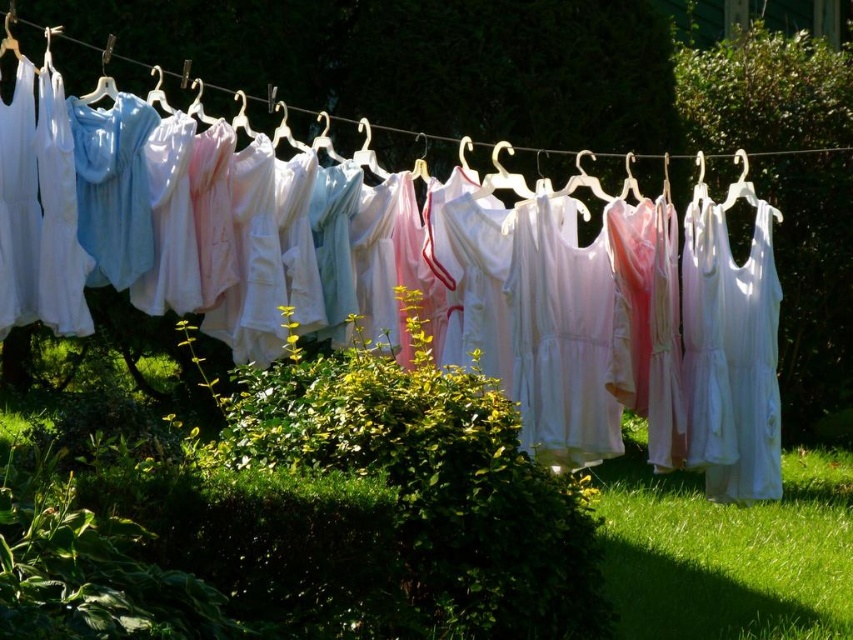
Question: Is white cotton dresses at center bigger than green grass at center?

Choices:
 (A) yes
 (B) no

Answer: (A)

Question: Which object is farther from the camera taking this photo?

Choices:
 (A) green grass at center
 (B) green grass at lower right

Answer: (A)

Question: Which point is closer to the camera?

Choices:
 (A) green grass at center
 (B) white fabric at center

Answer: (A)

Question: Considering the real-world distances, which object is farthest from the white cotton dresses at center?

Choices:
 (A) green grass at center
 (B) white fabric at center

Answer: (B)

Question: Is white fabric at center to the right of green grass at center from the viewer's perspective?

Choices:
 (A) no
 (B) yes

Answer: (A)

Question: From the image, what is the correct spatial relationship of white cotton dresses at center in relation to green grass at center?

Choices:
 (A) left
 (B) right

Answer: (A)